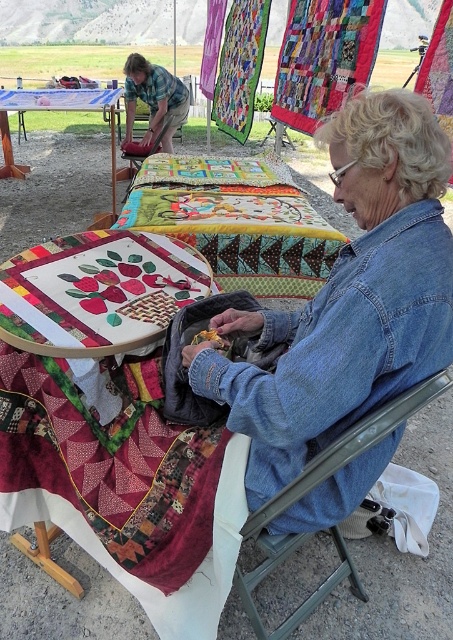
Question: Does denim jacket at lower right have a larger size compared to wooden table at center?

Choices:
 (A) no
 (B) yes

Answer: (A)

Question: From the image, what is the correct spatial relationship of denim jacket at lower right in relation to multicolored quilt at center?

Choices:
 (A) below
 (B) above

Answer: (A)

Question: Does embroidered fabric tablecloth at center have a greater width compared to metallic gray folding chair at lower right?

Choices:
 (A) yes
 (B) no

Answer: (A)

Question: Which point is farther from the camera taking this photo?

Choices:
 (A) pyautogui.click(x=303, y=241)
 (B) pyautogui.click(x=332, y=528)
 (C) pyautogui.click(x=10, y=93)

Answer: (C)

Question: Which object is farther from the camera taking this photo?

Choices:
 (A) wooden table at center
 (B) embroidered fabric tablecloth at center
 (C) brushed metal bucket at upper left
 (D) denim jacket at lower right

Answer: (C)

Question: Which object is farther from the camera taking this photo?

Choices:
 (A) wooden table at center
 (B) metallic gray folding chair at lower right
 (C) brushed metal bucket at upper left

Answer: (C)